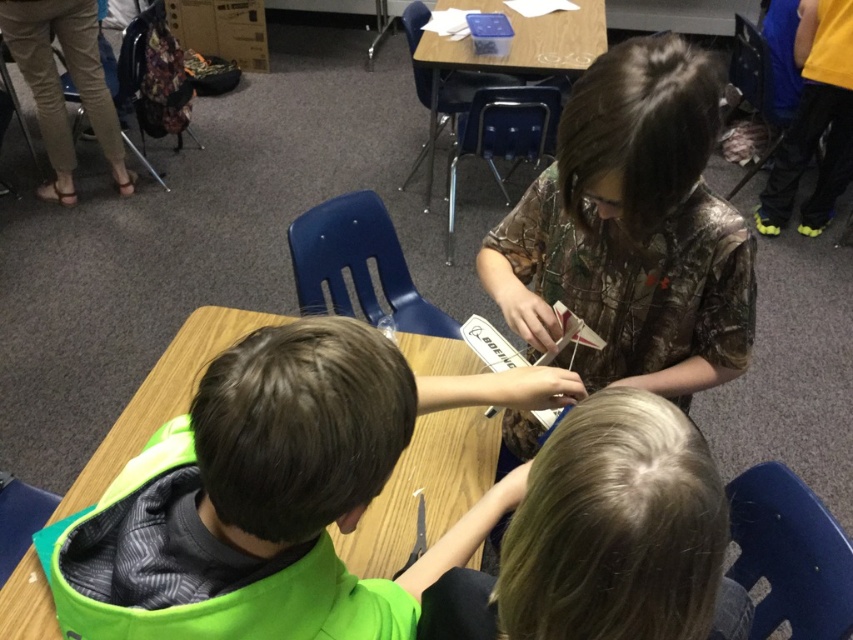
Does camouflage shirt at center appear on the left side of blonde hair at center?

→ No, camouflage shirt at center is not to the left of blonde hair at center.

Does camouflage shirt at center have a greater width compared to blonde hair at center?

Indeed, camouflage shirt at center has a greater width compared to blonde hair at center.

In order to click on camouflage shirt at center in this screenshot , I will do `click(631, 230)`.

Can you confirm if green fabric shirt at center is positioned to the right of camouflage shirt at center?

Incorrect, green fabric shirt at center is not on the right side of camouflage shirt at center.

Which is in front, point (350, 477) or point (621, 45)?

Point (350, 477) is more forward.

Which is behind, point (271, 516) or point (704, 196)?

The point (704, 196) is more distant.

Find the location of `green fabric shirt at center`. green fabric shirt at center is located at coordinates (258, 496).

Is green fabric shirt at center further to the viewer compared to blonde hair at center?

Yes, it is.

Is green fabric shirt at center to the left of blonde hair at center from the viewer's perspective?

Correct, you'll find green fabric shirt at center to the left of blonde hair at center.

What do you see at coordinates (258, 496) in the screenshot?
I see `green fabric shirt at center` at bounding box center [258, 496].

Identify the location of green fabric shirt at center. Image resolution: width=853 pixels, height=640 pixels. (258, 496).